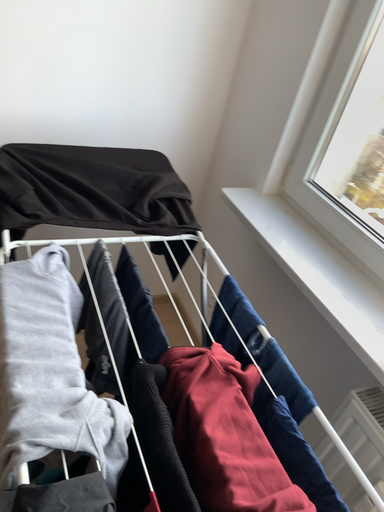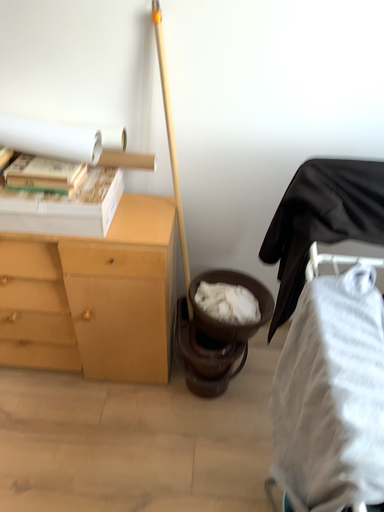
Question: Which way did the camera rotate in the video?

Choices:
 (A) rotated right
 (B) rotated left

Answer: (B)